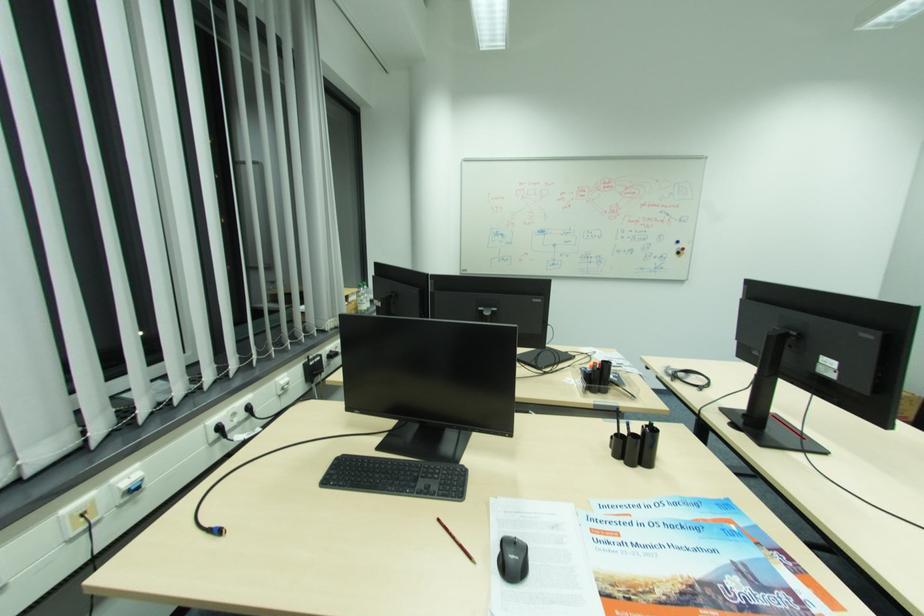
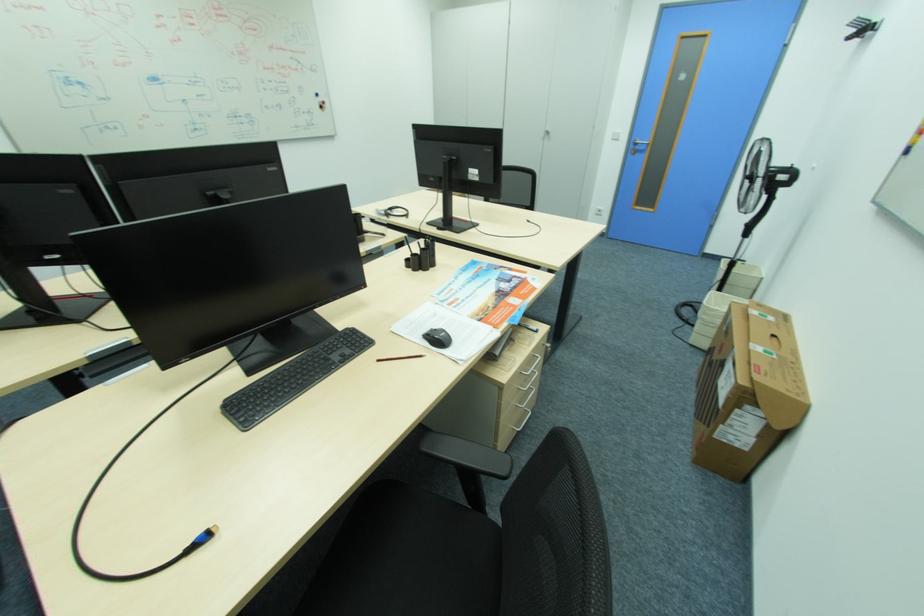
First-person continuous shooting, in which direction is the camera rotating?

The camera rotated toward right-down.